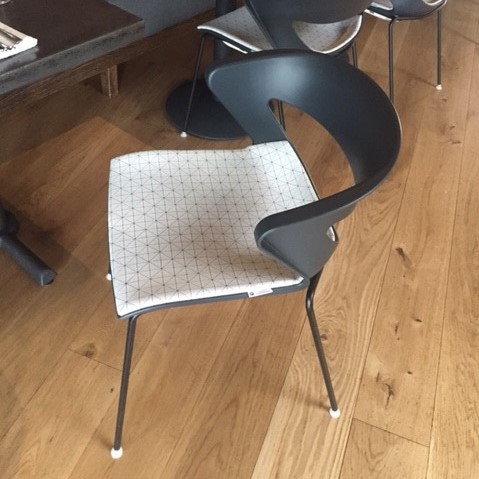
The image size is (479, 479). Identify the location of table or desk leg base. (18, 246).